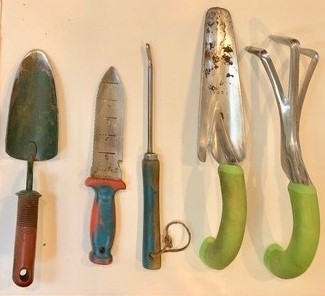
Where is `handle`? handle is located at coordinates (106, 224).